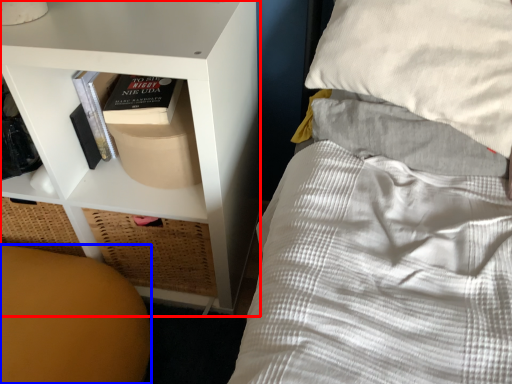
Question: Among these objects, which one is nearest to the camera, shelf (highlighted by a red box) or furniture (highlighted by a blue box)?

Choices:
 (A) shelf
 (B) furniture

Answer: (A)